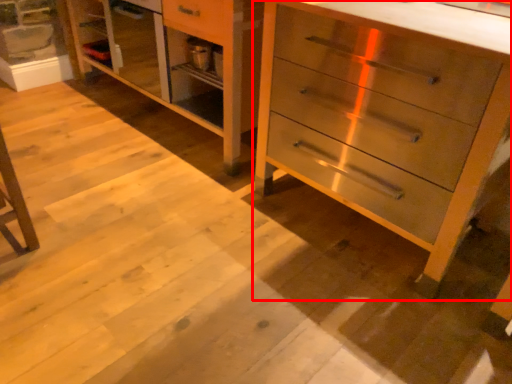
Question: From the image's perspective, where is chest of drawers (annotated by the red box) located relative to dresser?

Choices:
 (A) above
 (B) below

Answer: (B)